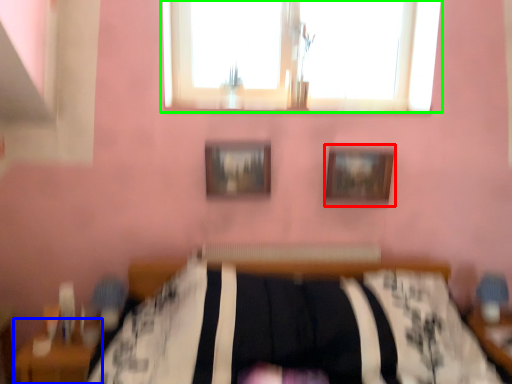
Question: Based on their relative distances, which object is farther from picture frame (highlighted by a red box)? Choose from table (highlighted by a blue box) and window (highlighted by a green box).

Choices:
 (A) table
 (B) window

Answer: (A)